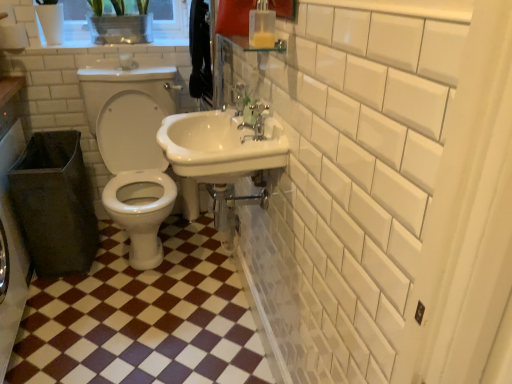
Describe the element at coordinates (253, 119) in the screenshot. I see `matte silver faucet at upper center` at that location.

What do you see at coordinates (133, 150) in the screenshot? I see `white glossy toilet at center` at bounding box center [133, 150].

The height and width of the screenshot is (384, 512). Describe the element at coordinates (120, 24) in the screenshot. I see `clear plastic container at upper left` at that location.

The image size is (512, 384). Identify the location of satin nickel faucet at upper center. (237, 98).

At what (x,y) coordinates should I click in order to perform the action: click on brown glossy tile at center. Please return your answer as a coordinate pair (x, y). The image size is (512, 384). Looking at the image, I should click on (143, 318).

Locate an element on the screen. matte silver faucet at upper center is located at coordinates click(253, 119).

Is matte silver faucet at upper center in front of satin nickel faucet at upper center?

Yes, matte silver faucet at upper center is closer to the camera.

Can you confirm if matte silver faucet at upper center is bigger than satin nickel faucet at upper center?

No, matte silver faucet at upper center is not bigger than satin nickel faucet at upper center.

What's the angular difference between matte silver faucet at upper center and satin nickel faucet at upper center's facing directions?

The angular difference between matte silver faucet at upper center and satin nickel faucet at upper center is 0 degrees.

Can you confirm if matte silver faucet at upper center is wider than satin nickel faucet at upper center?

Incorrect, the width of matte silver faucet at upper center does not surpass that of satin nickel faucet at upper center.

Can you tell me how much white glossy toilet at center and brown glossy tile at center differ in facing direction?

The angular difference between white glossy toilet at center and brown glossy tile at center is 0.486 degrees.

Choose the correct answer: Is white glossy toilet at center inside brown glossy tile at center or outside it?

white glossy toilet at center is not inside brown glossy tile at center, it's outside.

Is white glossy toilet at center turned away from brown glossy tile at center?

That's not correct — white glossy toilet at center is not looking away from brown glossy tile at center.

From the image's perspective, is white glossy toilet at center located above brown glossy tile at center?

Yes.

Which is closer, (253, 114) or (111, 33)?

Point (253, 114).

Looking at this image, from the image's perspective, is matte silver faucet at upper center above or below clear plastic container at upper left?

From the image's perspective, matte silver faucet at upper center appears below clear plastic container at upper left.

Would you say matte silver faucet at upper center contains clear plastic container at upper left?

No, clear plastic container at upper left is located outside of matte silver faucet at upper center.

Is matte silver faucet at upper center touching clear plastic container at upper left?

No, matte silver faucet at upper center is not in contact with clear plastic container at upper left.

Which is correct: white glossy sink at center is inside matte silver faucet at upper center, or outside of it?

white glossy sink at center is not enclosed by matte silver faucet at upper center.

Can you confirm if white glossy sink at center is smaller than matte silver faucet at upper center?

No, white glossy sink at center is not smaller than matte silver faucet at upper center.

Which is in front, point (170, 115) or point (254, 117)?

The point (254, 117) is closer.

Can you confirm if white glossy sink at center is shorter than satin nickel faucet at upper center?

Incorrect, the height of white glossy sink at center does not fall short of that of satin nickel faucet at upper center.

From the image's perspective, which is above, white glossy sink at center or satin nickel faucet at upper center?

satin nickel faucet at upper center is shown above in the image.

Can you tell me how much white glossy sink at center and satin nickel faucet at upper center differ in facing direction?

The angle between the facing direction of white glossy sink at center and the facing direction of satin nickel faucet at upper center is 0.00469 degrees.

Is point (196, 145) less distant than point (234, 96)?

Yes, point (196, 145) is closer to viewer.

From the image's perspective, who appears lower, white glossy toilet at center or clear plastic container at upper left?

white glossy toilet at center appears lower in the image.

Which point is more distant from viewer, (165, 193) or (141, 19)?

The point (141, 19) is more distant.

How distant is white glossy toilet at center from clear plastic container at upper left?

white glossy toilet at center is 19.76 inches from clear plastic container at upper left.

Does white glossy toilet at center come in front of clear plastic container at upper left?

Yes.

Can you confirm if clear plastic container at upper left is positioned to the right of satin nickel faucet at upper center?

No.

Is clear plastic container at upper left not near satin nickel faucet at upper center?

No.

Is point (101, 21) positioned after point (240, 110)?

That is True.

Measure the distance between clear plastic container at upper left and satin nickel faucet at upper center.

clear plastic container at upper left and satin nickel faucet at upper center are 33.43 inches apart.

In order to click on plumbing fixture below the matte silver faucet at upper center (from a real-world perspective) in this screenshot , I will do `click(237, 98)`.

The height and width of the screenshot is (384, 512). Find the location of `toilet located on the right of brown glossy tile at center`. toilet located on the right of brown glossy tile at center is located at coordinates pyautogui.click(x=133, y=150).

Looking at the image, which one is located further to clear plastic container at upper left, satin nickel faucet at upper center or brown glossy tile at center?

Among the two, brown glossy tile at center is located further to clear plastic container at upper left.

Considering their positions, is satin nickel faucet at upper center positioned further to white glossy sink at center than brown glossy tile at center?

brown glossy tile at center.

Based on the photo, from the image, which object appears to be farther from satin nickel faucet at upper center, clear plastic container at upper left or brown glossy tile at center?

The object further to satin nickel faucet at upper center is brown glossy tile at center.

Which object lies nearer to the anchor point white glossy toilet at center, matte silver faucet at upper center or satin nickel faucet at upper center?

satin nickel faucet at upper center lies closer to white glossy toilet at center than the other object.

Based on their spatial positions, is white glossy toilet at center or white glossy sink at center further from clear plastic container at upper left?

white glossy sink at center is further to clear plastic container at upper left.

Estimate the real-world distances between objects in this image. Which object is closer to brown glossy tile at center, clear plastic container at upper left or white glossy sink at center?

white glossy sink at center is closer to brown glossy tile at center.

Which object lies further to the anchor point satin nickel faucet at upper center, clear plastic container at upper left or white glossy toilet at center?

clear plastic container at upper left is further to satin nickel faucet at upper center.

Which object lies further to the anchor point white glossy sink at center, clear plastic container at upper left or white glossy toilet at center?

clear plastic container at upper left is positioned further to the anchor white glossy sink at center.

The image size is (512, 384). Identify the location of plumbing fixture located between white glossy sink at center and clear plastic container at upper left in the depth direction. (237, 98).

What are the coordinates of `plumbing fixture that lies between clear plastic container at upper left and white glossy toilet at center from top to bottom` in the screenshot? It's located at (237, 98).

At what (x,y) coordinates should I click in order to perform the action: click on toilet located between matte silver faucet at upper center and clear plastic container at upper left in the depth direction. Please return your answer as a coordinate pair (x, y). Looking at the image, I should click on (133, 150).

What are the coordinates of `sink between satin nickel faucet at upper center and brown glossy tile at center vertically` in the screenshot? It's located at (x=220, y=146).